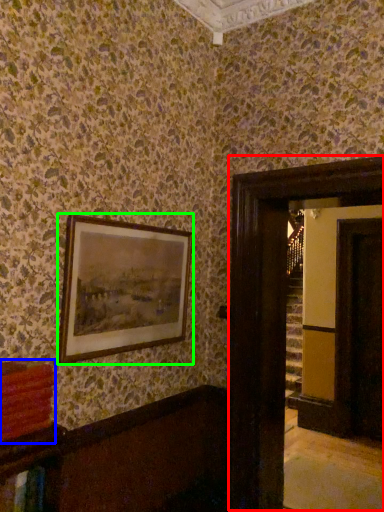
Question: Based on their relative distances, which object is nearer to glass door (highlighted by a red box)? Choose from book (highlighted by a blue box) and picture frame (highlighted by a green box).

Choices:
 (A) book
 (B) picture frame

Answer: (B)